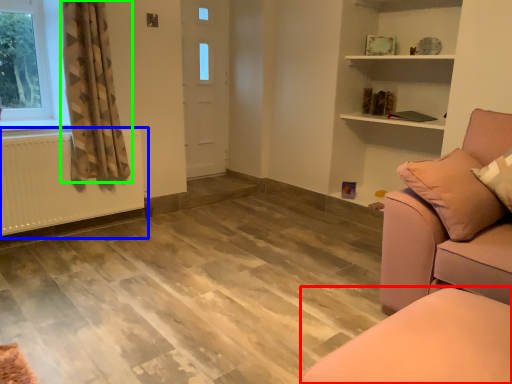
Question: Based on their relative distances, which object is farther from furniture (highlighted by a red box)? Choose from radiator (highlighted by a blue box) and curtain (highlighted by a green box).

Choices:
 (A) radiator
 (B) curtain

Answer: (A)